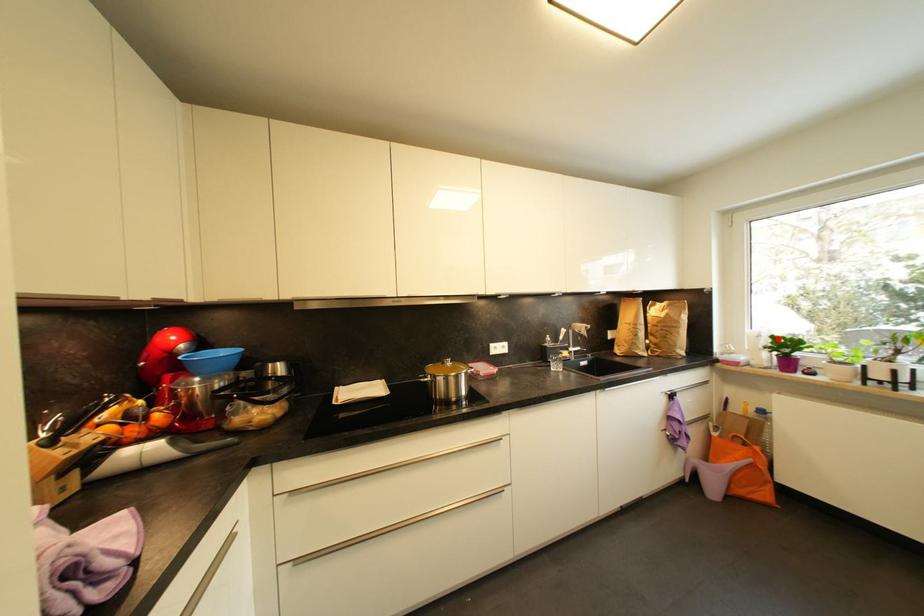
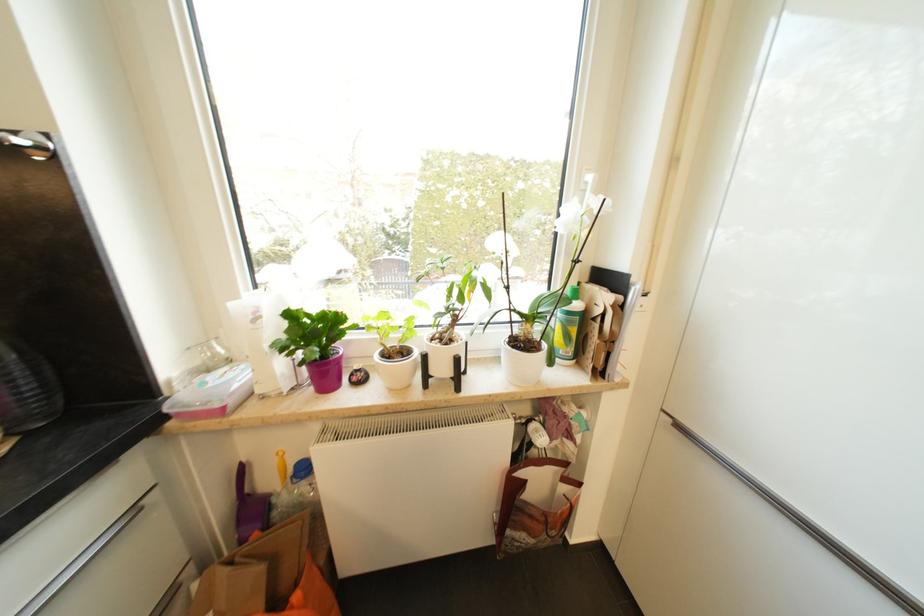
Locate, in the second image, the point that corresponds to the highlighted location in the first image.

(295, 317)